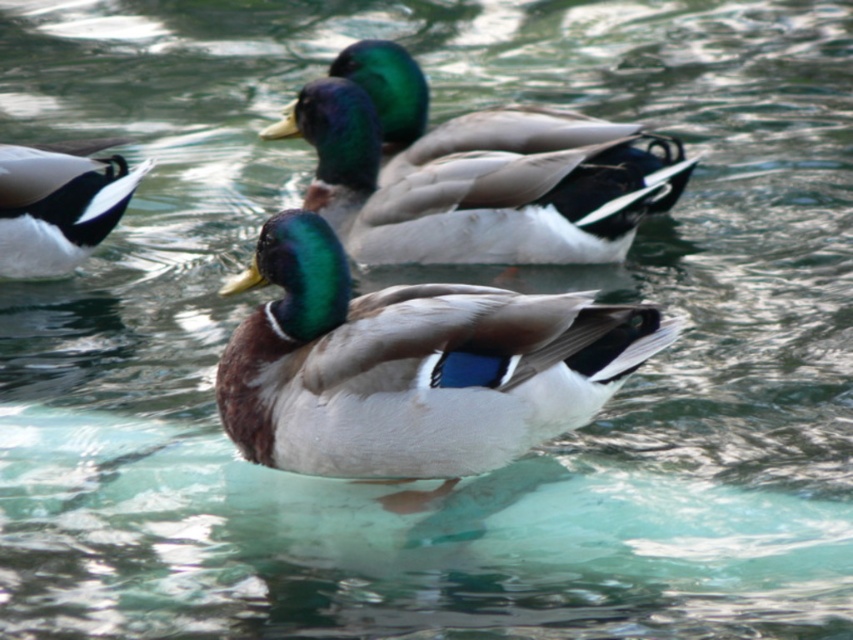
From the picture: You are standing at the edge of a pond and want to observe a specific point in the water. The point is located at coordinates point (344, 177). If you have a camera with a focal length of 50mm, what is the approximate distance in meters between you and the point?

The distance of point (344, 177) from viewer is 6.17 meters, so the approximate distance between you and the point is 6.17 meters.

You are observing a group of ducks in a pond. You notice two features in the scene described by the object labels. Which of the two objects, the shiny green head at center or the shiny black feathers at left, is positioned higher in the image?

The shiny green head at center is taller than the shiny black feathers at left, so the shiny green head at center is positioned higher in the image.